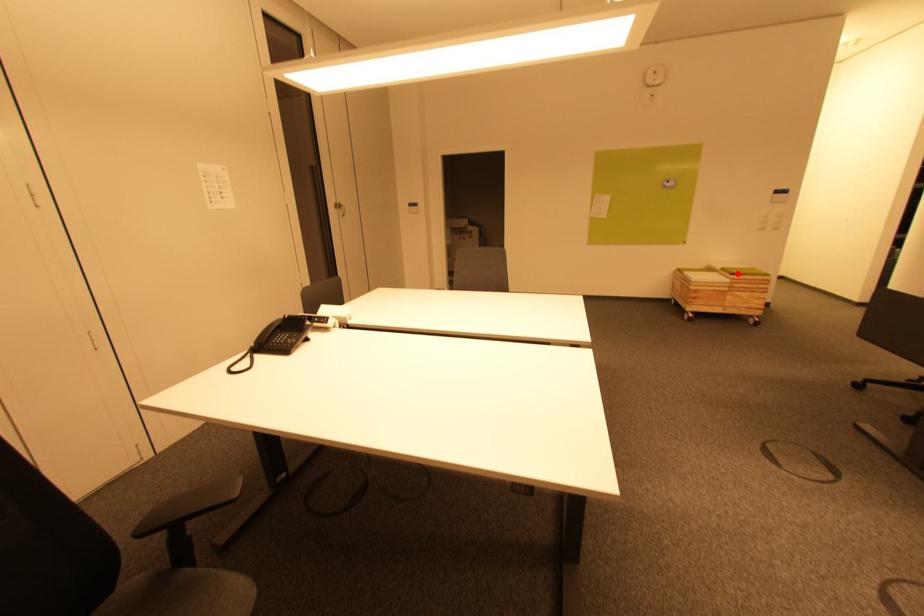
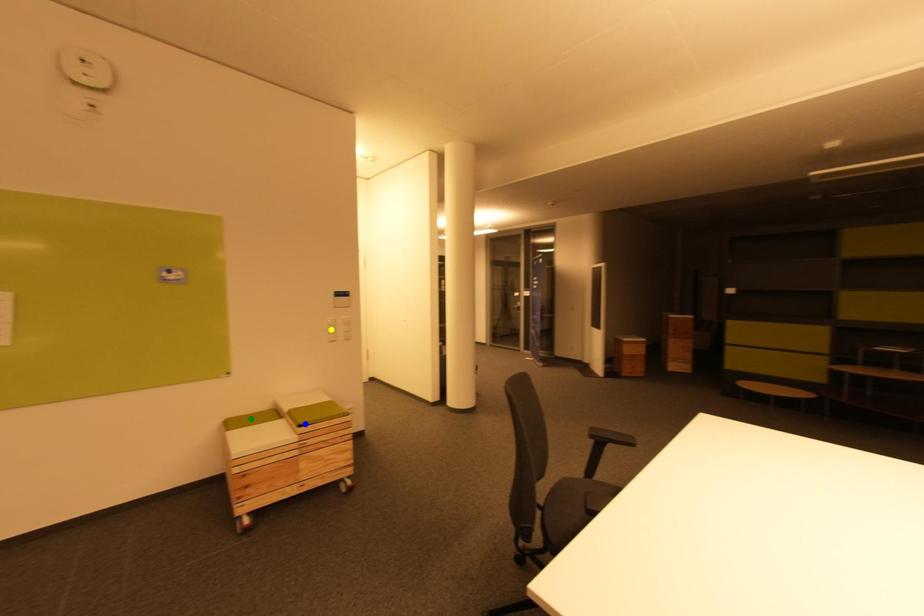
Question: I am providing you with two images of the same scene from different viewpoints. A red point is marked on the first image. You are given multiple points on the second image. Which point in image 2 represents the same 3d spot as the red point in image 1?

Choices:
 (A) green point
 (B) blue point
 (C) yellow point

Answer: (B)